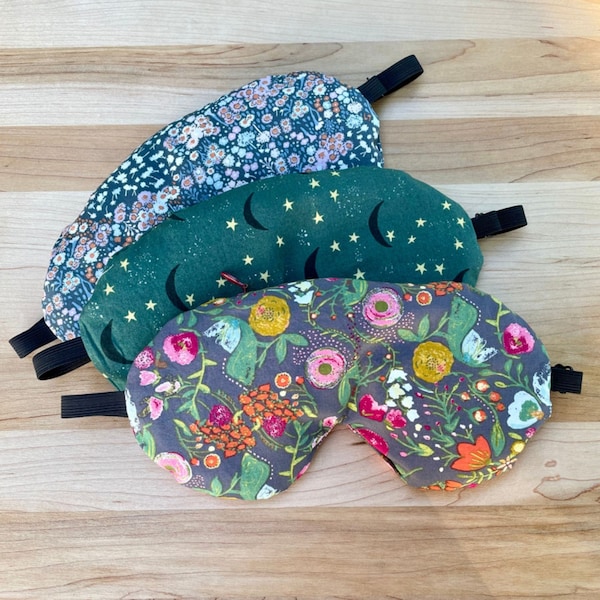
In order to click on fabric purple background with floral patterns all over it in this screenshot , I will do `click(224, 375)`, `click(183, 360)`, `click(250, 462)`, `click(252, 312)`, `click(392, 303)`, `click(518, 326)`, `click(520, 408)`, `click(419, 432)`, `click(430, 362)`, `click(392, 355)`.